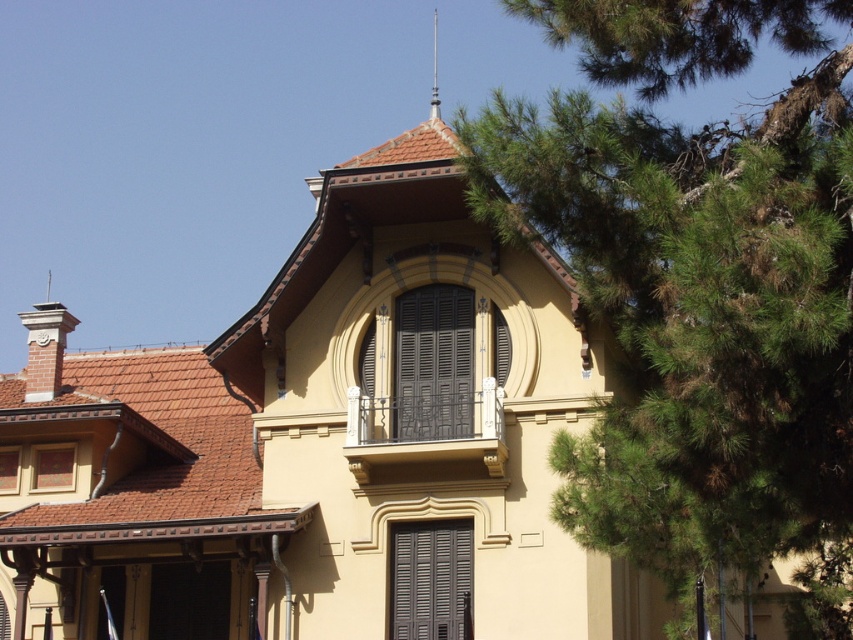
Does point (436, 605) lie in front of point (434, 99)?

That is True.

Can you confirm if dark gray matte shutters at center is taller than polished silver spire at upper center?

No, dark gray matte shutters at center is not taller than polished silver spire at upper center.

Between point (393, 634) and point (434, 60), which one is positioned in front?

Positioned in front is point (393, 634).

Locate an element on the screen. dark gray matte shutters at center is located at coordinates (430, 579).

Who is more distant from viewer, (x=805, y=154) or (x=434, y=102)?

The point (x=434, y=102) is behind.

Between point (737, 429) and point (434, 58), which one is positioned behind?

Point (434, 58)

At what (x,y) coordinates should I click in order to perform the action: click on green leafy tree at upper right. Please return your answer as a coordinate pair (x, y). This screenshot has height=640, width=853. Looking at the image, I should click on (700, 320).

Between point (410, 323) and point (434, 20), which one is positioned behind?

The point (434, 20) is behind.

Is point (434, 387) positioned in front of point (432, 88)?

Yes, point (434, 387) is in front of point (432, 88).

I want to click on matte black shutters at center, so click(433, 364).